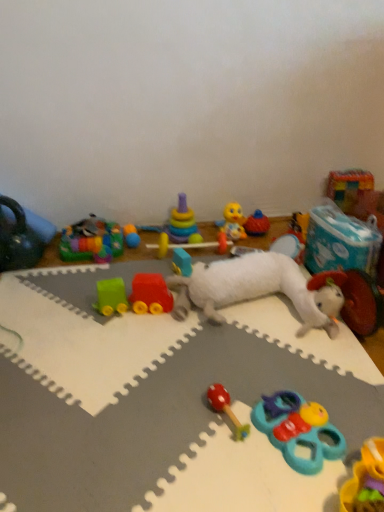
This screenshot has width=384, height=512. In order to click on vacant area that is in front of stacked plastic rings at center, which is the 12th toy from right to left in this screenshot , I will do `click(171, 254)`.